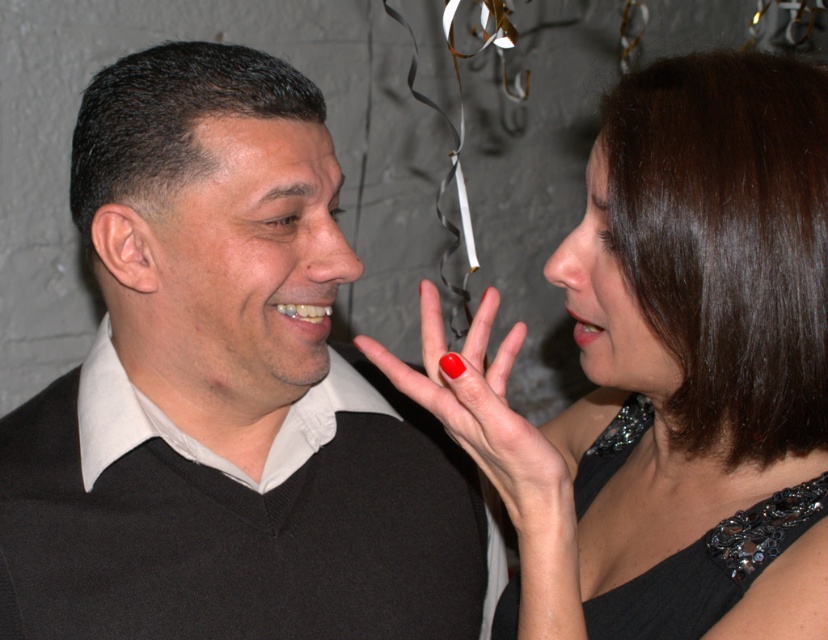
You are a photographer adjusting the focus on your camera. You want to capture both the black sequined dress at center and the shiny red nail at center in sharp detail. Since the camera can only focus on one object at a time, which object should you focus on to ensure the other is still in focus given their distance?

The black sequined dress at center is 5.30 inches away from the shiny red nail at center. To ensure both are in focus, focus on the object that is farther away from the camera. However, since the distance between them is small, using a smaller aperture might help achieve depth of field to keep both in focus. Alternatively, focus on the shiny red nail at center as it is closer to the camera, allowing the black sequined dress at center to fall within the depth of field range.

You are a photographer trying to capture a clear shot of both the black matte sweater at left and the black sequined dress at center. Since you want both subjects in focus, which one should you adjust your camera to prioritize focusing on first?

You should prioritize focusing on the black sequined dress at center first because the black matte sweater at left is closer to the viewer, so it will naturally be in focus if the dress is also in focus. However, if the depth of field is limited, focusing on the dress ensures both are sharp since the sweater is closer and might be within the same focal plane.